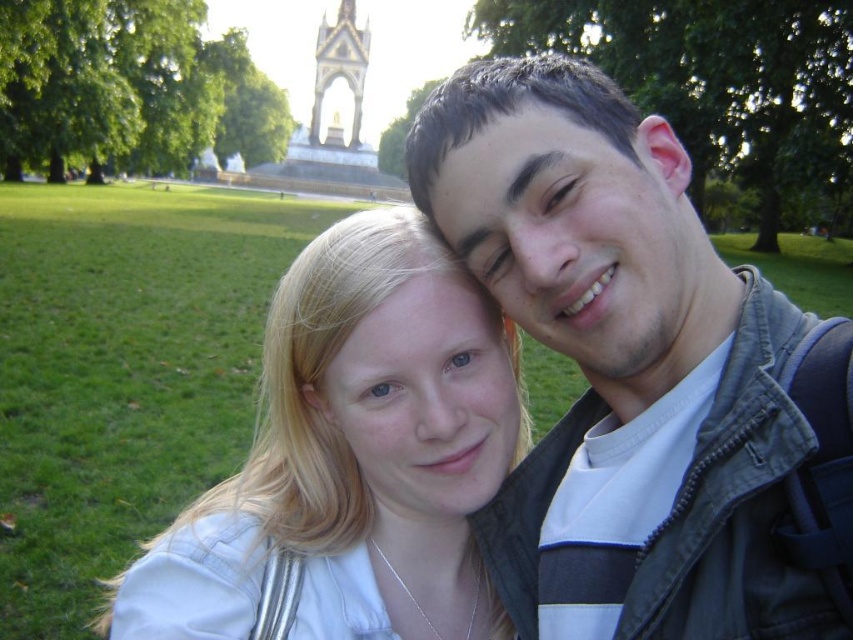
You are taking a photo of two friends in the park. You notice two points marked in the image. The first point is at coordinates point [119,625] and the second is at point [363,28]. Which point is closer to the camera?

Point [119,625] is in front of point [363,28], so the first point is closer to the camera.

You are standing in the park and want to take a photo of the dark green jacket at center. Where should you position yourself to capture it in the frame?

Position yourself at point (x=640, y=374) to capture the dark green jacket at center in the frame.

You are a photographer trying to capture a photo of the monument in the background. You have two items in the scene, the dark green jacket at center and the white fabric at center. If you want to ensure both items are in focus, what is the minimum distance you need to be from the monument?

The dark green jacket at center and white fabric at center are 18.43 meters apart. To ensure both are in focus, you need to be at least 18.43 meters away from the monument.